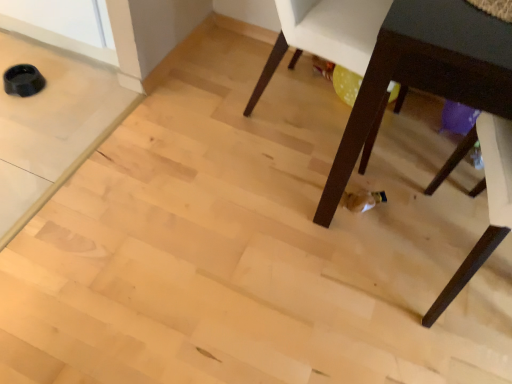
Locate an element on the screen. The image size is (512, 384). vacant location behind dark wood chair at lower right, the first chair viewed from the right is located at coordinates (421, 168).